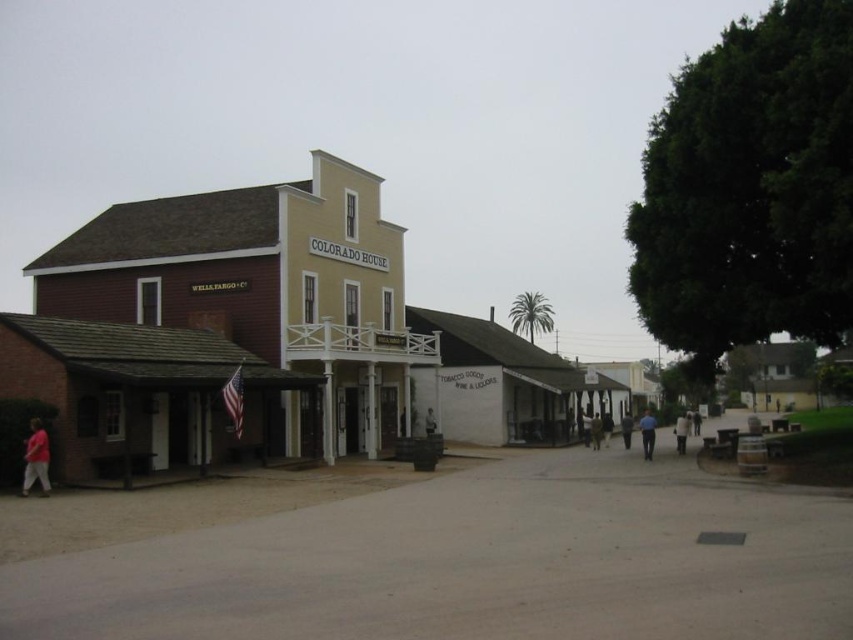
You are a photographer standing on the street in front of the Colorado House. You want to take a photo that includes both the pink fabric shirt at lower left and the blue uniform at center. How far apart are these two objects in the scene?

The pink fabric shirt at lower left and the blue uniform at center are 19.09 meters apart from each other.